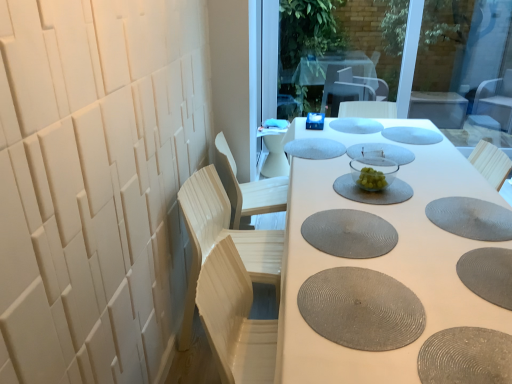
This screenshot has height=384, width=512. I want to click on free area in between gray textured placemat at lower right, the eighth manhole cover in the back-to-front sequence, and clear glass bowl at center, so click(433, 225).